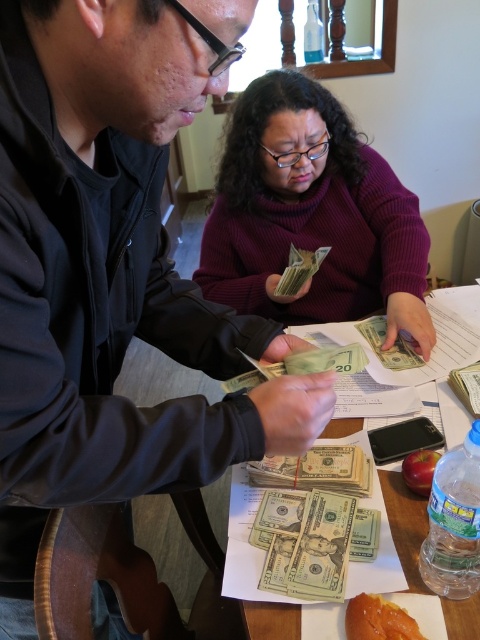
You are a fashion designer observing this scene. You need to determine which item has a smaller width between the matte black jacket at upper left and the purple turtleneck sweater at center. Which one is it?

The matte black jacket at upper left is thinner than the purple turtleneck sweater at center, so the matte black jacket at upper left has a smaller width.

Consider the image. You are a financial auditor observing the scene. You need to determine if the matte black jacket at upper left is taller than the green paper money at center. Based on the scene description, can you confirm this?

Yes, the matte black jacket at upper left is taller than the green paper money at center according to the description.